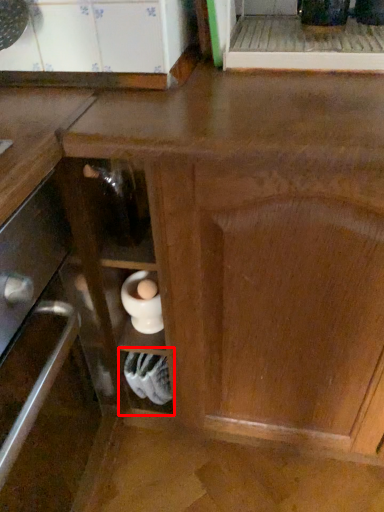
Question: From the image, what is the correct spatial relationship of shelf (annotated by the red box) in relation to appliance?

Choices:
 (A) left
 (B) right

Answer: (A)